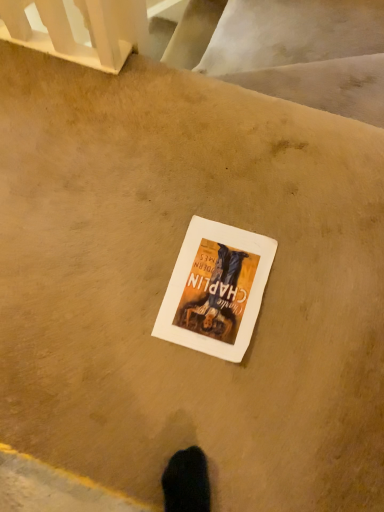
Locate an element on the screen. This screenshot has width=384, height=512. white paper at center is located at coordinates (216, 289).

What do you see at coordinates (216, 289) in the screenshot? I see `white paper at center` at bounding box center [216, 289].

Where is `white paper at center`? white paper at center is located at coordinates (216, 289).